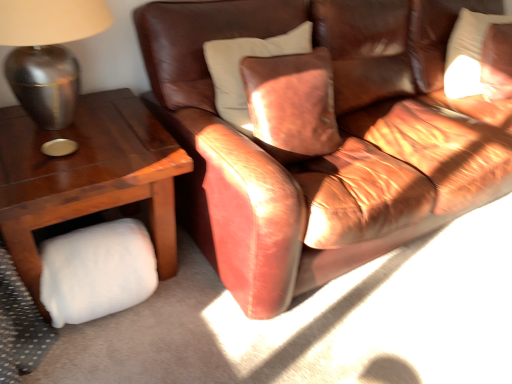
What are the coordinates of `free space above woodenobject at left (from a real-world perspective)` in the screenshot? It's located at (80, 142).